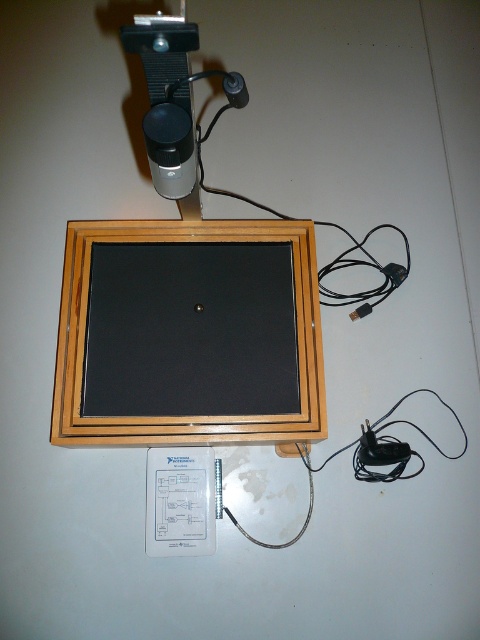
You are an engineer inspecting the setup. You need to adjust the camera mounted on the wooden frame at center. To do so, you must first unplug the black plastic plug at upper center. Which object should you move first to access the plug?

The wooden frame at center is further to the viewer than the black plastic plug at upper center, so you should move the wooden frame at center first to access the plug.

You are an electrician checking the setup. The wooden frame at center and the black plastic plug at upper center are both connected to the wall socket. Which one requires more space due to its size?

The wooden frame at center requires more space because it has a larger size compared to the black plastic plug at upper center.